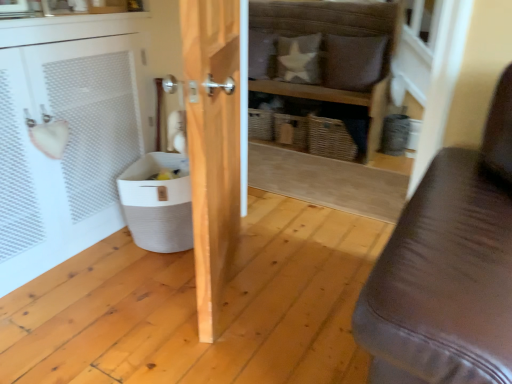
Question: Is white fabric pillow at upper center, the second pillow when ordered from right to left, behind wooden door at center?

Choices:
 (A) no
 (B) yes

Answer: (B)

Question: Can you confirm if white fabric pillow at upper center, the second pillow when ordered from right to left, is bigger than wooden door at center?

Choices:
 (A) yes
 (B) no

Answer: (B)

Question: Is white fabric pillow at upper center, the 1th pillow in the left-to-right sequence, aimed at wooden door at center?

Choices:
 (A) yes
 (B) no

Answer: (A)

Question: Can you confirm if white fabric pillow at upper center, the 1th pillow in the left-to-right sequence, is positioned to the left of wooden door at center?

Choices:
 (A) yes
 (B) no

Answer: (B)

Question: Considering the relative sizes of white fabric pillow at upper center, the 1th pillow in the left-to-right sequence, and wooden door at center in the image provided, is white fabric pillow at upper center, the 1th pillow in the left-to-right sequence, smaller than wooden door at center?

Choices:
 (A) yes
 (B) no

Answer: (A)

Question: Looking at the image, does white woven laundry basket at lower left seem bigger or smaller compared to white fabric pillow at upper center, the second pillow when ordered from right to left?

Choices:
 (A) big
 (B) small

Answer: (A)

Question: Is white woven laundry basket at lower left taller or shorter than white fabric pillow at upper center, the 1th pillow in the left-to-right sequence?

Choices:
 (A) tall
 (B) short

Answer: (B)

Question: From the image's perspective, is white woven laundry basket at lower left above or below white fabric pillow at upper center, the 1th pillow in the left-to-right sequence?

Choices:
 (A) above
 (B) below

Answer: (B)

Question: Looking at their shapes, would you say white woven laundry basket at lower left is wider or thinner than white fabric pillow at upper center, the 1th pillow in the left-to-right sequence?

Choices:
 (A) wide
 (B) thin

Answer: (A)

Question: Choose the correct answer: Is wooden shelf at center inside wooden door at center or outside it?

Choices:
 (A) outside
 (B) inside

Answer: (A)

Question: Is point (348, 21) positioned closer to the camera than point (227, 193)?

Choices:
 (A) closer
 (B) farther

Answer: (B)

Question: In terms of size, does wooden shelf at center appear bigger or smaller than wooden door at center?

Choices:
 (A) small
 (B) big

Answer: (B)

Question: Relative to wooden door at center, is wooden shelf at center in front or behind?

Choices:
 (A) front
 (B) behind

Answer: (B)

Question: Is wooden door at center inside the boundaries of wooden shelf at center, or outside?

Choices:
 (A) inside
 (B) outside

Answer: (B)

Question: Is wooden door at center wider or thinner than wooden shelf at center?

Choices:
 (A) thin
 (B) wide

Answer: (A)